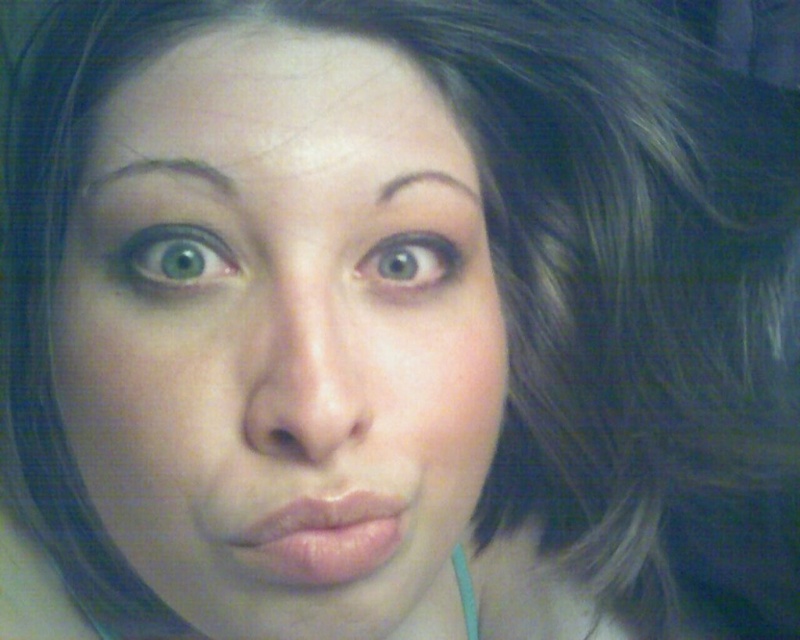
Looking at this image, you are a makeup artist analyzing a client photo. The client has a green matte eye at upper center and dark brown hair at upper center. Which feature is positioned higher on their face?

The dark brown hair at upper center is positioned higher than the green matte eye at upper center because the green matte eye at upper center is below it.

You are a photographer who wants to ensure the subject of the portrait has a balanced composition. Considering the sizes of the smooth skin face at center and the pink glossy lips at center, which one should you adjust in your camera framing to maintain a harmonious balance?

The smooth skin face at center is bigger than the pink glossy lips at center. To maintain a harmonious balance, you should adjust the framing to either reduce the prominence of the larger face or enhance the visibility of the smaller lips.